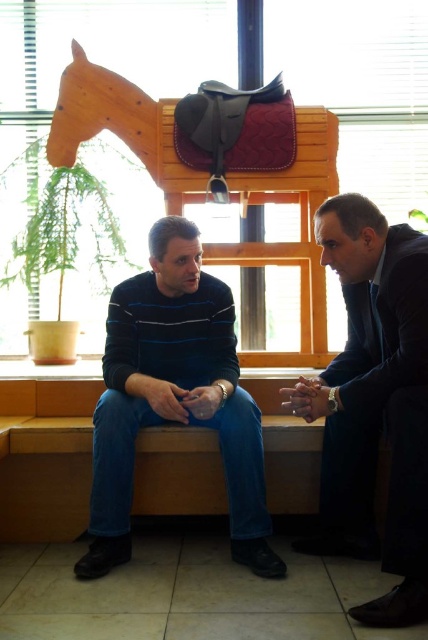
You are a photographer trying to capture a candid shot of the dark blue suit at center and the wooden horse at upper center. To ensure both subjects are in frame, you need to know their relative positions. Which object is positioned to the right of the other?

The dark blue suit at center is to the right of the wooden horse at upper center.

Consider the image. You are designing a storage box that needs to accommodate both the dark blue striped sweater at center and the wooden horse at upper center. Which object requires the storage box to have a larger width dimension?

The wooden horse at upper center requires the storage box to have a larger width dimension because it is thicker than the dark blue striped sweater at center.

You are trying to locate the dark blue suit at center in the image. According to the scene description, where exactly is it positioned?

The dark blue suit at center is located at point (374, 403).